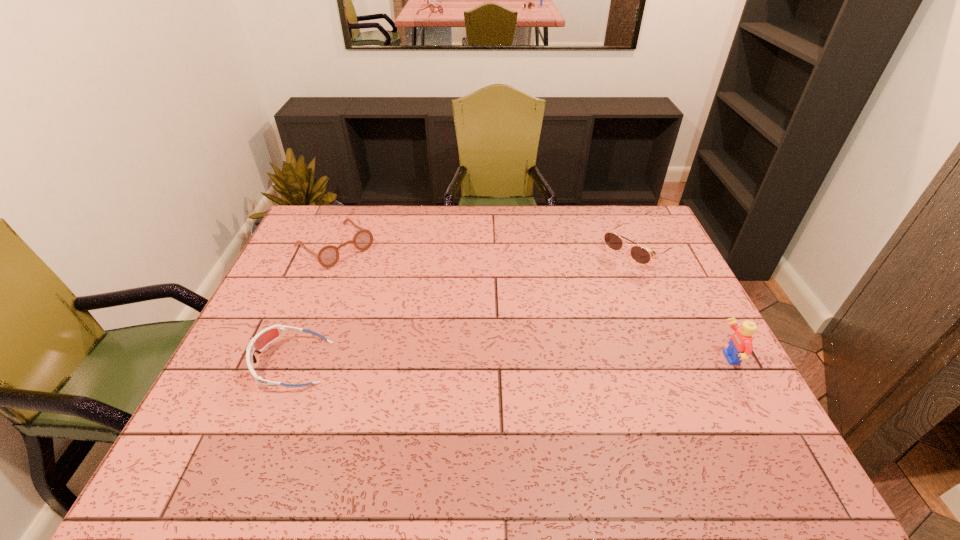
The width and height of the screenshot is (960, 540). Identify the location of vacant space located on the front-facing side of the spectacles. (379, 284).

This screenshot has width=960, height=540. What are the coordinates of `free space located on the front-facing side of the spectacles` in the screenshot? It's located at point(433,329).

You are a GUI agent. You are given a task and a screenshot of the screen. Output one action in this format:
    pyautogui.click(x=<x>, y=<y>)
    Task: Click on the vacant space located on the front lenses of the third shortest object
    
    Given the screenshot: What is the action you would take?
    pyautogui.click(x=553, y=316)

Locate an element on the screen. The width and height of the screenshot is (960, 540). vacant space positioned 0.220m on the front lenses of the third shortest object is located at coordinates (572, 301).

You are a GUI agent. You are given a task and a screenshot of the screen. Output one action in this format:
    pyautogui.click(x=<x>, y=<y>)
    Task: Click on the vacant space located 0.060m on the front lenses of the third shortest object
    The width and height of the screenshot is (960, 540).
    Given the screenshot: What is the action you would take?
    pyautogui.click(x=605, y=276)

The image size is (960, 540). Identify the location of spectacles that is at the far edge. (327, 256).

Find the location of `sunglasses that is at the far edge`. sunglasses that is at the far edge is located at coordinates (639, 254).

This screenshot has width=960, height=540. What are the coordinates of `goggles situated at the left edge` in the screenshot? It's located at (258, 343).

Identify the location of spectacles that is at the left edge. The width and height of the screenshot is (960, 540). (327, 256).

Where is `Lego situated at the right edge`? Lego situated at the right edge is located at coordinates (740, 346).